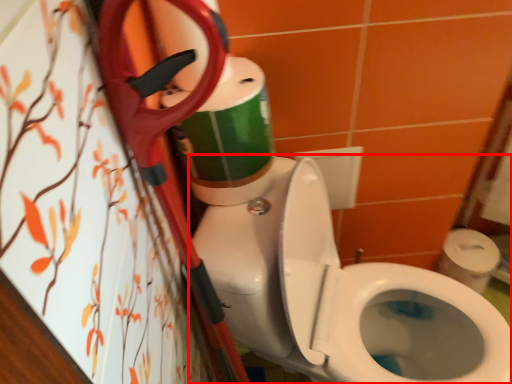
Question: From the image, what is the correct spatial relationship of toilet (annotated by the red box) in relation to toilet paper?

Choices:
 (A) right
 (B) left

Answer: (A)